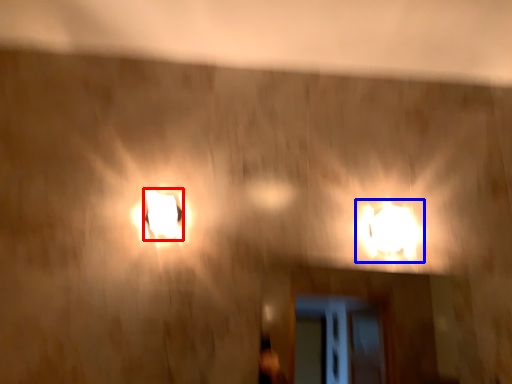
Question: Which point is closer to the camera, lamp (highlighted by a red box) or lamp (highlighted by a blue box)?

Choices:
 (A) lamp
 (B) lamp

Answer: (A)